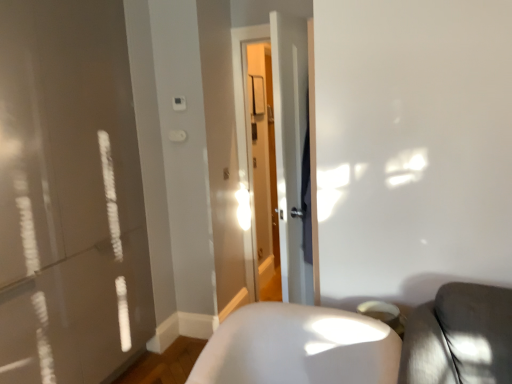
Question: Does transparent glass door at center lie behind white glossy chair at lower right?

Choices:
 (A) no
 (B) yes

Answer: (B)

Question: Does transparent glass door at center have a greater height compared to white glossy chair at lower right?

Choices:
 (A) yes
 (B) no

Answer: (A)

Question: From a real-world perspective, is transparent glass door at center physically above white glossy chair at lower right?

Choices:
 (A) yes
 (B) no

Answer: (A)

Question: Does transparent glass door at center contain white glossy chair at lower right?

Choices:
 (A) no
 (B) yes

Answer: (A)

Question: From the image's perspective, would you say transparent glass door at center is positioned over white glossy chair at lower right?

Choices:
 (A) yes
 (B) no

Answer: (A)

Question: Considering the relative sizes of transparent glass door at center and white glossy chair at lower right in the image provided, is transparent glass door at center wider than white glossy chair at lower right?

Choices:
 (A) yes
 (B) no

Answer: (B)

Question: From a real-world perspective, is white glossy chair at lower right on top of transparent glass door at center?

Choices:
 (A) yes
 (B) no

Answer: (B)

Question: Would you say white glossy chair at lower right is outside transparent glass door at center?

Choices:
 (A) no
 (B) yes

Answer: (B)

Question: Is white glossy chair at lower right placed right next to transparent glass door at center?

Choices:
 (A) yes
 (B) no

Answer: (B)

Question: Does white glossy chair at lower right come in front of transparent glass door at center?

Choices:
 (A) no
 (B) yes

Answer: (B)

Question: Considering the relative positions of white glossy chair at lower right and transparent glass door at center in the image provided, is white glossy chair at lower right to the right of transparent glass door at center from the viewer's perspective?

Choices:
 (A) no
 (B) yes

Answer: (A)

Question: Is white glossy chair at lower right facing towards transparent glass door at center?

Choices:
 (A) no
 (B) yes

Answer: (A)

Question: In terms of width, does white glossy chair at lower right look wider or thinner when compared to transparent glass door at center?

Choices:
 (A) wide
 (B) thin

Answer: (A)